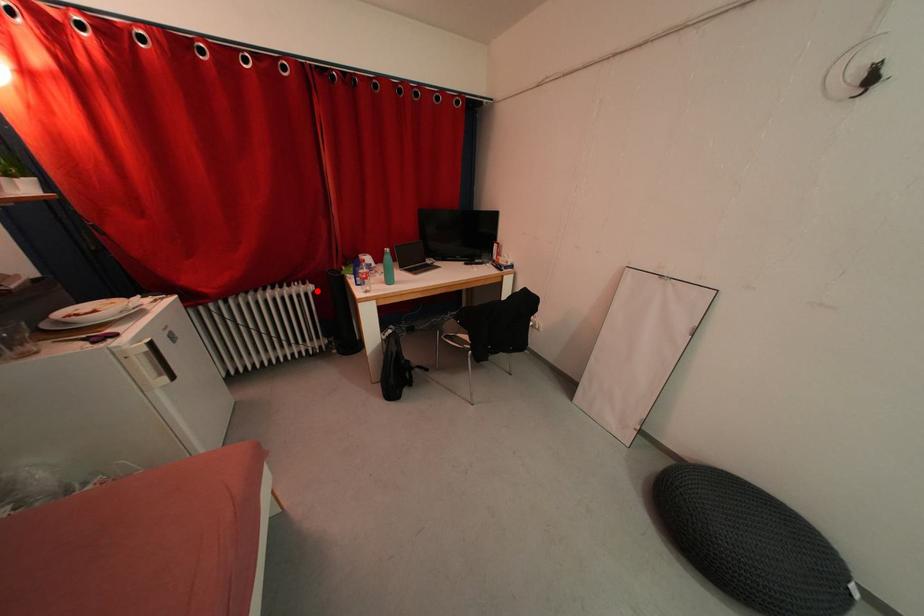
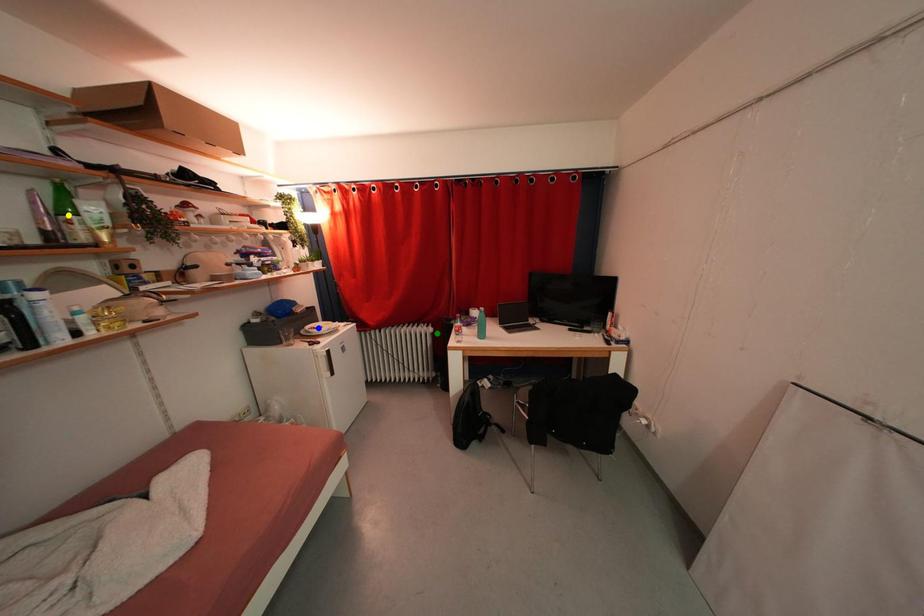
Question: I am providing you with two images of the same scene from different viewpoints. A red point is marked on the first image. You are given multiple points on the second image. Which spot in image 2 lines up with the point in image 1?

Choices:
 (A) green point
 (B) yellow point
 (C) blue point

Answer: (A)